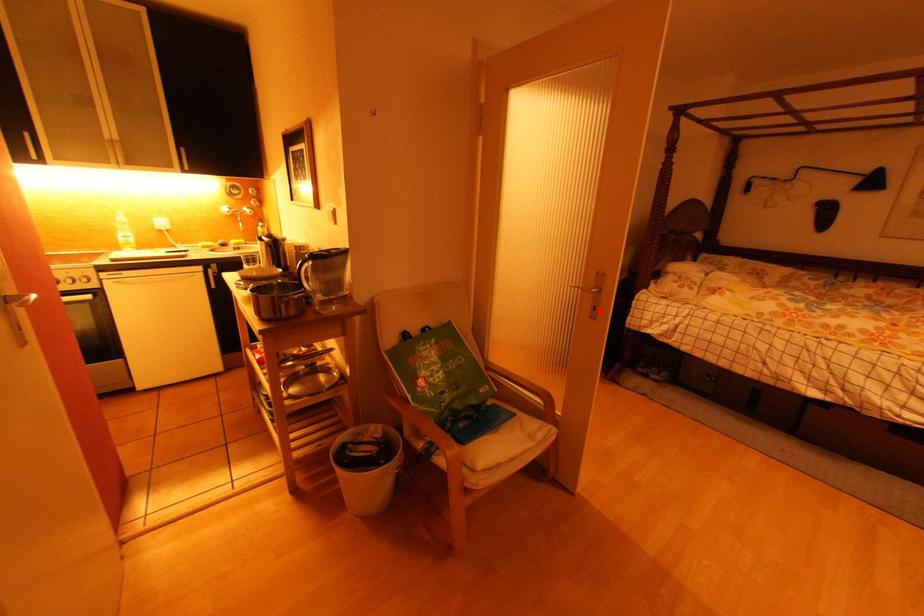
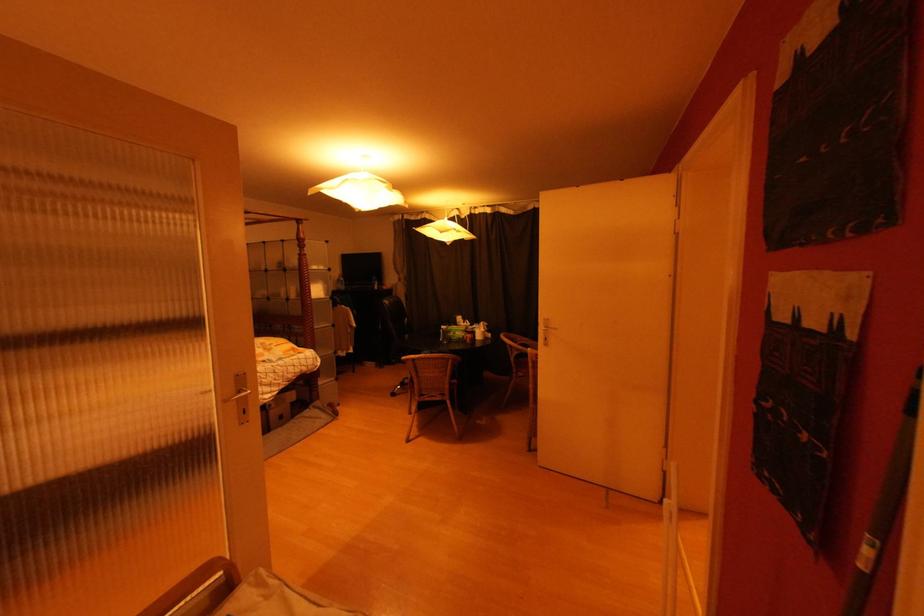
Locate, in the second image, the point that corresponds to the highlighted location in the first image.

(249, 415)